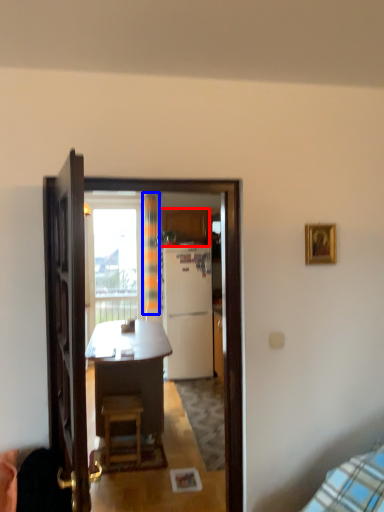
Question: Which object is closer to the camera taking this photo, cabinetry (highlighted by a red box) or curtain (highlighted by a blue box)?

Choices:
 (A) cabinetry
 (B) curtain

Answer: (B)